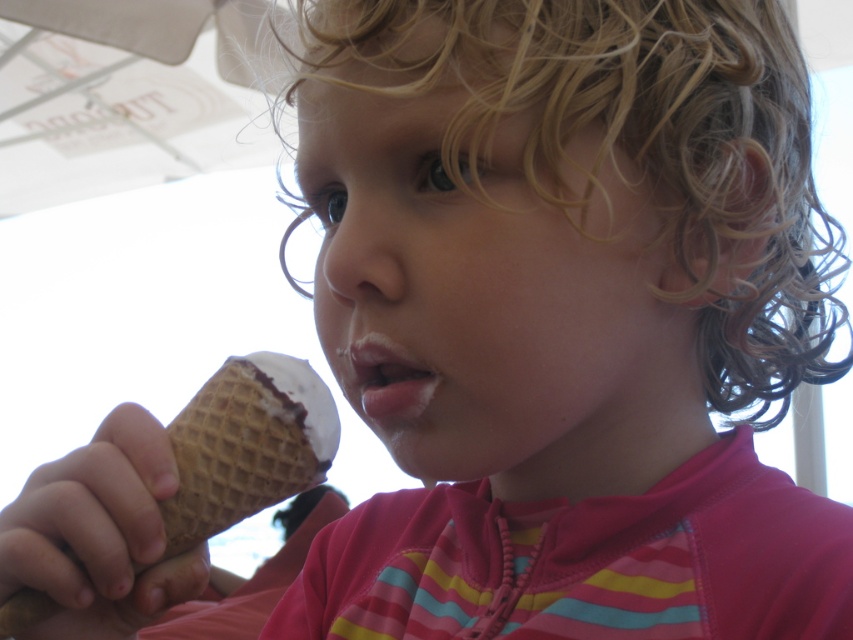
This screenshot has width=853, height=640. What do you see at coordinates (247, 445) in the screenshot?
I see `waffle cone ice cream at lower left` at bounding box center [247, 445].

Who is positioned more to the left, waffle cone ice cream at lower left or pink matte lips at center?

Positioned to the left is waffle cone ice cream at lower left.

Describe the element at coordinates (247, 445) in the screenshot. I see `waffle cone ice cream at lower left` at that location.

Find the location of a particular element. This screenshot has height=640, width=853. waffle cone ice cream at lower left is located at coordinates (247, 445).